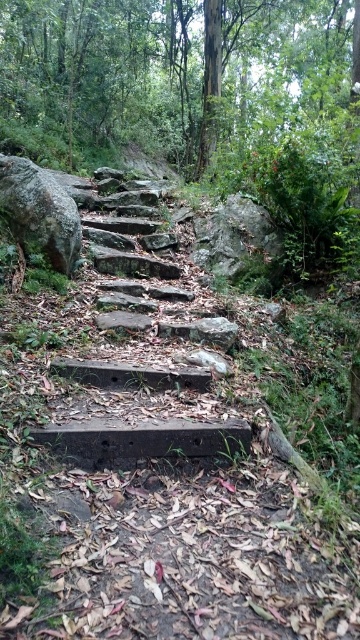
Describe the element at coordinates (176, 77) in the screenshot. I see `green leafy tree at upper center` at that location.

What do you see at coordinates (176, 77) in the screenshot?
I see `green leafy tree at upper center` at bounding box center [176, 77].

Image resolution: width=360 pixels, height=640 pixels. Find the location of `green leafy tree at upper center`. green leafy tree at upper center is located at coordinates (176, 77).

The height and width of the screenshot is (640, 360). Describe the element at coordinates (39, 212) in the screenshot. I see `rough gray rock at left` at that location.

Does rough gray rock at left appear on the left side of gray rough rock at center?

Yes, rough gray rock at left is to the left of gray rough rock at center.

The width and height of the screenshot is (360, 640). Identify the location of rough gray rock at left. (39, 212).

Consider the image. Is green leafy tree at upper center positioned before concrete stairs at center?

No, it is behind concrete stairs at center.

Is green leafy tree at upper center taller than concrete stairs at center?

Yes, green leafy tree at upper center is taller than concrete stairs at center.

Is point (186, 54) positioned in front of point (231, 458)?

That is False.

Locate an element on the screen. This screenshot has height=640, width=360. green leafy tree at upper center is located at coordinates (176, 77).